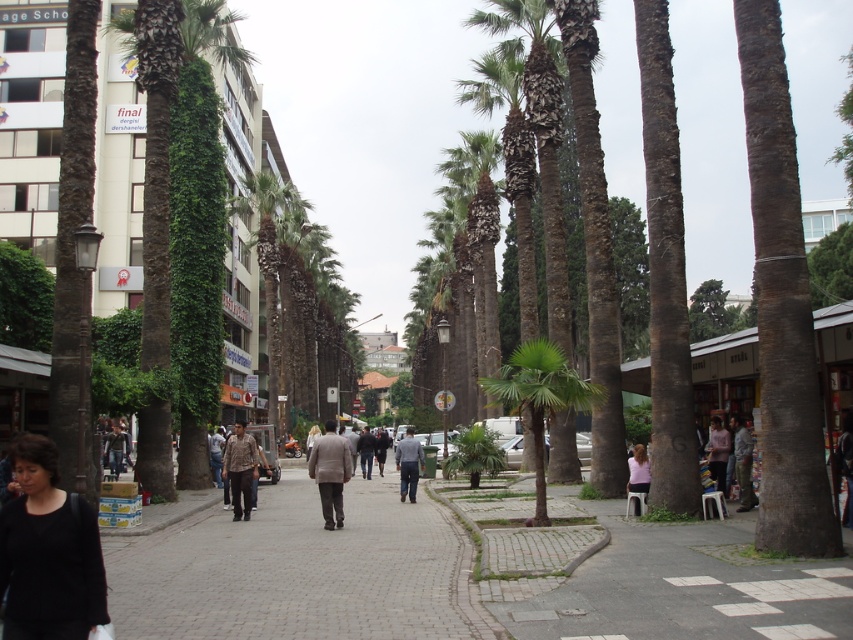
You are a photographer standing in the middle of the urban street scene. You notice a brown textured shirt at center and a pink fabric at center. Which one is located to the left when viewed from your perspective?

The brown textured shirt at center is positioned on the left side of the pink fabric at center, so from your perspective, the brown textured shirt at center is to the left of the pink fabric at center.

You are a fashion designer observing a street scene. You notice a black matte shirt at lower left and a light gray fabric jacket at center. Which clothing item takes up more space in the scene?

The light gray fabric jacket at center takes up more space in the scene because the black matte shirt at lower left occupies less space than it.

You are a photographer standing in the middle of the urban street scene. You notice a brown textured shirt at center and a pink fabric at center. Which object should you adjust your camera focus to capture first if you want to photograph both items in the same frame?

The brown textured shirt at center is much taller than the pink fabric at center, so you should focus on the brown textured shirt at center first to ensure it fits within the frame before adjusting for the shorter pink fabric at center.